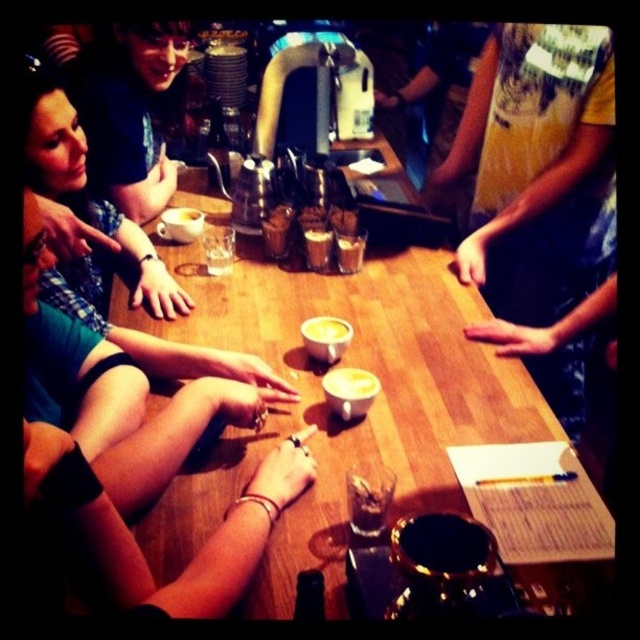
Image resolution: width=640 pixels, height=640 pixels. What do you see at coordinates (132, 115) in the screenshot?
I see `matte black shirt at upper left` at bounding box center [132, 115].

Which is behind, point (157, 212) or point (339, 355)?

The point (157, 212) is more distant.

What do you see at coordinates (132, 115) in the screenshot? I see `matte black shirt at upper left` at bounding box center [132, 115].

Identify the location of matte black shirt at upper left. The height and width of the screenshot is (640, 640). (132, 115).

Does matte black shirt at upper left appear on the right side of white matte cup at center?

In fact, matte black shirt at upper left is to the left of white matte cup at center.

What are the coordinates of `matte black shirt at upper left` in the screenshot? It's located at (132, 115).

Find the location of a particular element. Image resolution: width=640 pixels, height=640 pixels. matte black shirt at upper left is located at coordinates (132, 115).

Which of these two, matte black arm at lower left or yellow frothy beverage at center, stands taller?

With more height is matte black arm at lower left.

Find the location of a particular element. Image resolution: width=640 pixels, height=640 pixels. matte black arm at lower left is located at coordinates (134, 540).

Identify the location of matte black arm at lower left. (134, 540).